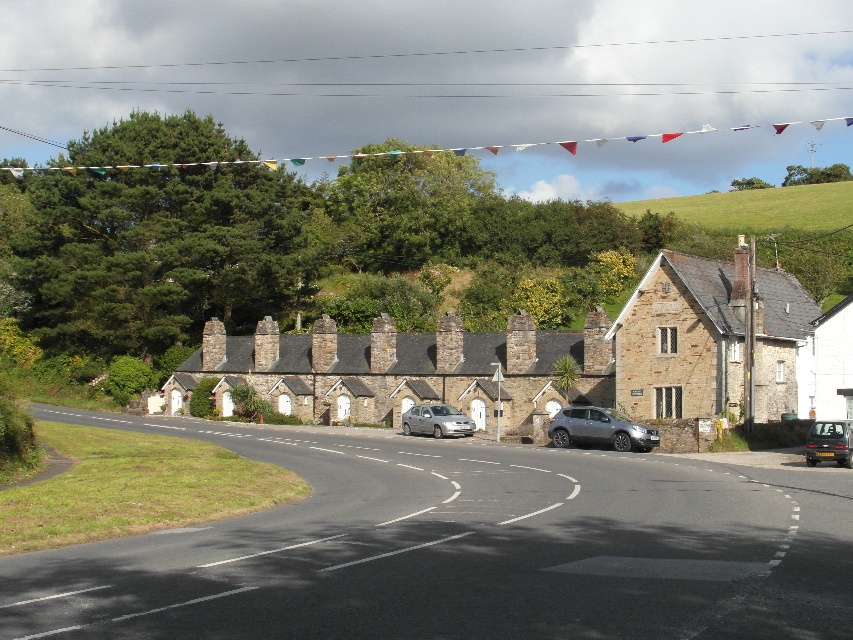
Question: Which is farther from the silver metallic van at center?

Choices:
 (A) green grassy hillside at upper right
 (B) metallic silver car at lower right
 (C) satin silver car at lower right

Answer: (A)

Question: Does brown stone cottages at center lie behind satin silver car at lower right?

Choices:
 (A) no
 (B) yes

Answer: (B)

Question: Can you confirm if satin silver car at lower right is thinner than metallic silver car at lower right?

Choices:
 (A) yes
 (B) no

Answer: (B)

Question: Considering the real-world distances, which object is farthest from the green grassy hillside at upper right?

Choices:
 (A) satin silver car at lower right
 (B) metallic silver car at lower right
 (C) silver metallic van at center
 (D) brown stone cottages at center

Answer: (B)

Question: Which point is farther from the camera taking this photo?

Choices:
 (A) (642, 436)
 (B) (422, 420)

Answer: (B)

Question: Is brown stone cottages at center bigger than satin silver car at lower right?

Choices:
 (A) no
 (B) yes

Answer: (B)